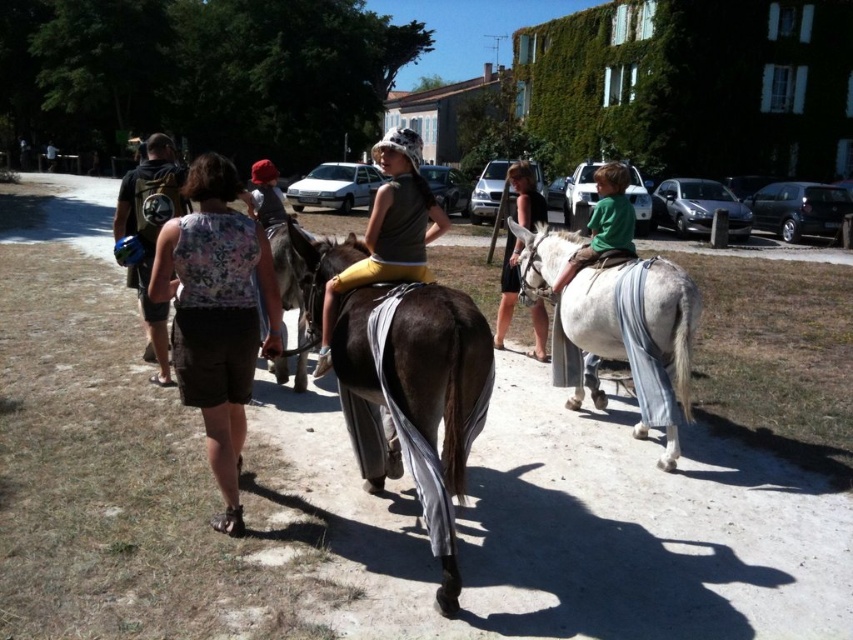
Is matte brown horse at center thinner than camouflage fabric backpack at left?

Indeed, matte brown horse at center has a lesser width compared to camouflage fabric backpack at left.

Between matte brown horse at center and camouflage fabric backpack at left, which one is positioned higher?

camouflage fabric backpack at left

Between point (404, 253) and point (146, 141), which one is positioned behind?

Point (146, 141)

Identify the location of matte brown horse at center. tap(389, 228).

Who is more forward, [637,332] or [546,323]?

Point [637,332] is in front.

Can you confirm if white cloth-covered mule at right is bigger than black fabric dress at center?

Indeed, white cloth-covered mule at right has a larger size compared to black fabric dress at center.

The image size is (853, 640). What do you see at coordinates (636, 337) in the screenshot?
I see `white cloth-covered mule at right` at bounding box center [636, 337].

Identify the location of white cloth-covered mule at right. (636, 337).

Who is more distant from viewer, (170, 268) or (515, 292)?

Positioned behind is point (515, 292).

Does floral fabric top at center have a greater width compared to black fabric dress at center?

Yes.

Who is more forward, (195, 227) or (518, 250)?

Point (195, 227)

Find the location of a particular element. floral fabric top at center is located at coordinates (218, 314).